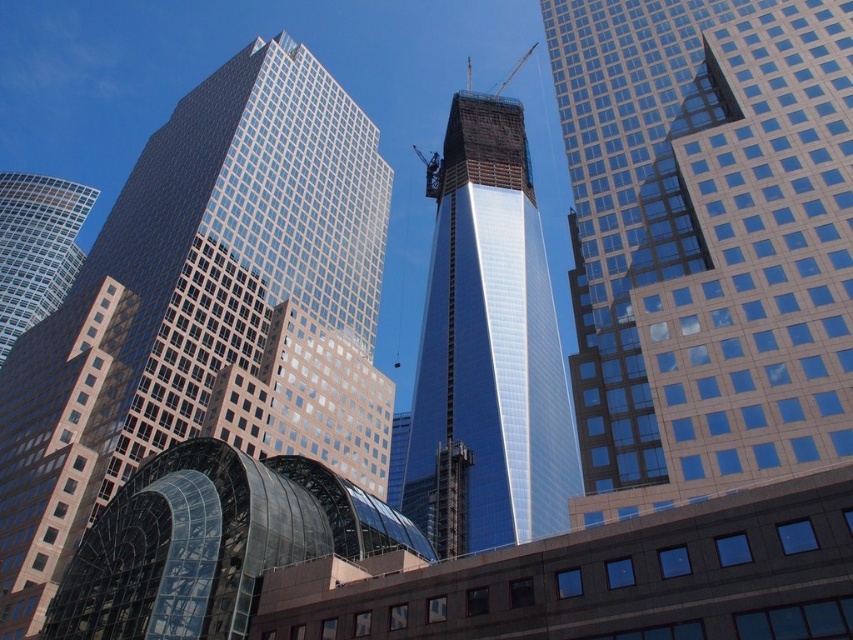
Question: From the image, what is the correct spatial relationship of glassy reflective skyscraper at center in relation to matte glass skyscraper at left?

Choices:
 (A) right
 (B) left

Answer: (A)

Question: Which of the following is the closest to the observer?

Choices:
 (A) (10, 241)
 (B) (402, 496)
 (C) (814, 384)

Answer: (C)

Question: Can you confirm if glassy reflective skyscraper at center is positioned above shiny glass skyscraper at center?

Choices:
 (A) yes
 (B) no

Answer: (B)

Question: Which object is the farthest from the glassy steel skyscraper at center?

Choices:
 (A) shiny glass skyscraper at center
 (B) glassy reflective skyscraper at center
 (C) matte glass skyscraper at left

Answer: (C)

Question: Is glassy reflective skyscraper at center to the left of shiny glass skyscraper at center from the viewer's perspective?

Choices:
 (A) yes
 (B) no

Answer: (A)

Question: Which of the following is the farthest from the observer?

Choices:
 (A) (68, 269)
 (B) (463, 316)
 (C) (773, 243)

Answer: (A)